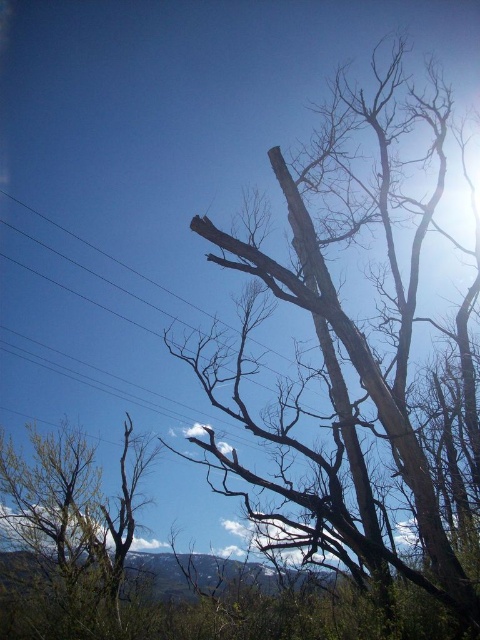
Who is higher up, brown rough bark tree at center or green leafy tree at lower left?

brown rough bark tree at center is above.

Which is more to the right, brown rough bark tree at center or green leafy tree at lower left?

brown rough bark tree at center is more to the right.

Does point (315, 547) come closer to viewer compared to point (69, 541)?

Yes.

Find the location of `brown rough bark tree at center`. brown rough bark tree at center is located at coordinates (344, 339).